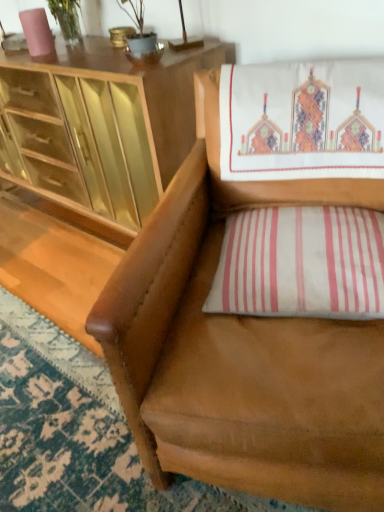
Question: Looking at their shapes, would you say white striped pillow at lower right is wider or thinner than matte wood cabinet at upper left?

Choices:
 (A) thin
 (B) wide

Answer: (A)

Question: Looking at the image, does white striped pillow at lower right seem bigger or smaller compared to matte wood cabinet at upper left?

Choices:
 (A) big
 (B) small

Answer: (B)

Question: Estimate the real-world distances between objects in this image. Which object is farther from the matte wood cabinet at upper left?

Choices:
 (A) white striped pillow at lower right
 (B) brown leather chair at center

Answer: (A)

Question: Which of these objects is positioned closest to the matte wood cabinet at upper left?

Choices:
 (A) white striped pillow at lower right
 (B) brown leather chair at center

Answer: (B)